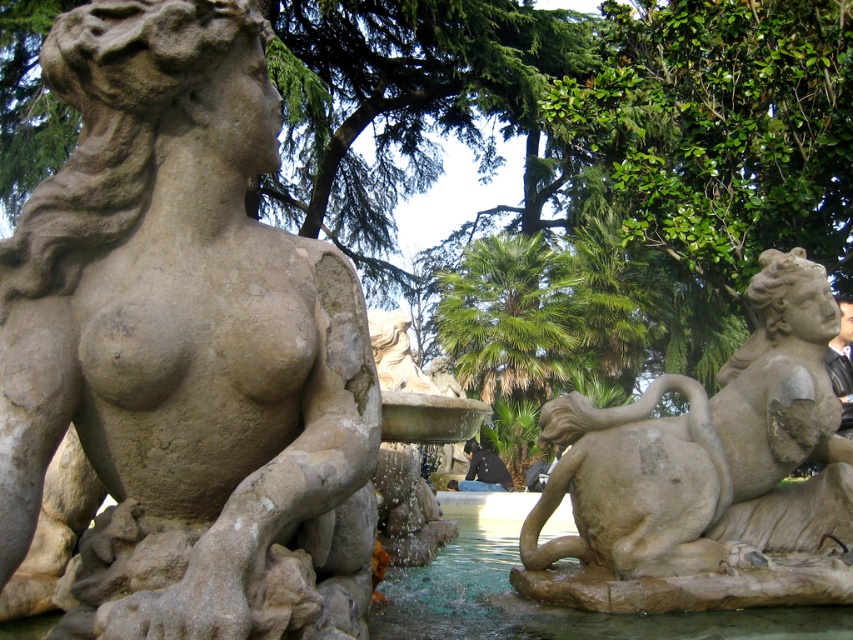
You are standing in the garden and want to take a photo of the fountain. The camera you are using has a limited field of view. The point representing the matte stone statue at left is at coordinates point (184, 346). If the camera can only capture objects within the rectangle defined by coordinates from 0.4 to 0.6 on the x and y axes, will the matte stone statue at left be fully visible in the photo?

The point representing the matte stone statue at left is at coordinates point (184, 346), which falls within the rectangle defined by 0.4 to 0.6 on both axes. Therefore, the matte stone statue at left will be fully visible in the photo.

You are a visitor in the garden and want to take a photo of the clear water at fountain center. To avoid the matte stone statue at left blocking the view, where should you position yourself relative to the statue?

You should position yourself to the right side of the matte stone statue at left so that the statue is out of the frame and you can capture the clear water at fountain center without obstruction.

You are standing in the garden and see the classical fountain sculpture. There is a point marked at coordinates (184, 346). What object is located at this point?

The point at coordinates (184, 346) indicates the matte stone statue at left.